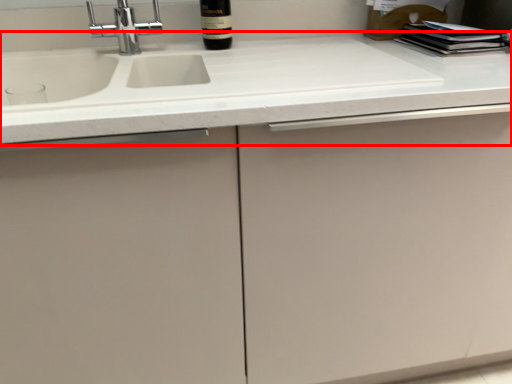
Question: From the image, what is the correct spatial relationship of countertop (annotated by the red box) in relation to bottle?

Choices:
 (A) right
 (B) left

Answer: (B)